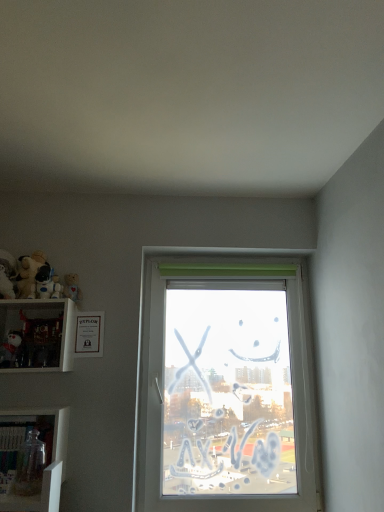
Where is `matte white plush at left, acting as the 2th toy starting from the bottom`? This screenshot has width=384, height=512. matte white plush at left, acting as the 2th toy starting from the bottom is located at coordinates tap(11, 349).

How much space does clear glass jar at lower left, acting as the 1th shelf starting from the bottom, occupy vertically?

9.90 inches.

The image size is (384, 512). Describe the element at coordinates (224, 383) in the screenshot. I see `transparent glass window at center` at that location.

Image resolution: width=384 pixels, height=512 pixels. What do you see at coordinates (28, 274) in the screenshot? I see `soft plush bear at upper left, the 2th toy in the top-to-bottom sequence` at bounding box center [28, 274].

Describe the element at coordinates (36, 335) in the screenshot. I see `white glossy shelf at left, the first shelf in the top-to-bottom sequence` at that location.

This screenshot has height=512, width=384. I want to click on matte white plush at left, acting as the 2th toy starting from the bottom, so click(x=11, y=349).

Based on the photo, how different are the orientations of white glossy shelf at left, the second shelf when ordered from bottom to top, and clear glass jar at lower left, the second shelf viewed from the top, in degrees?

5.39e-05 degrees.

Which of these two, white glossy shelf at left, the second shelf when ordered from bottom to top, or clear glass jar at lower left, acting as the 1th shelf starting from the bottom, stands taller?

With more height is white glossy shelf at left, the second shelf when ordered from bottom to top.

From a real-world perspective, is white glossy shelf at left, the second shelf when ordered from bottom to top, located beneath clear glass jar at lower left, the second shelf viewed from the top?

Incorrect, from a real-world perspective, white glossy shelf at left, the second shelf when ordered from bottom to top, is higher than clear glass jar at lower left, the second shelf viewed from the top.

From the image's perspective, which object appears higher, white glossy shelf at left, the second shelf when ordered from bottom to top, or clear glass jar at lower left, the second shelf viewed from the top?

white glossy shelf at left, the second shelf when ordered from bottom to top, is shown above in the image.

Could you measure the distance between white glossy shelf at left, the second shelf when ordered from bottom to top, and transparent glass jar at lower left, the fifth toy from the top?

white glossy shelf at left, the second shelf when ordered from bottom to top, and transparent glass jar at lower left, the fifth toy from the top, are 15.81 inches apart from each other.

From the image's perspective, which is below, white glossy shelf at left, the first shelf in the top-to-bottom sequence, or transparent glass jar at lower left, the fifth toy from the top?

transparent glass jar at lower left, the fifth toy from the top, appears lower in the image.

Is white glossy shelf at left, the first shelf in the top-to-bottom sequence, inside the boundaries of transparent glass jar at lower left, the fifth toy from the top, or outside?

white glossy shelf at left, the first shelf in the top-to-bottom sequence, lies outside transparent glass jar at lower left, the fifth toy from the top.

Is white plush toy at upper left, placed as the third toy when sorted from bottom to top, completely or partially outside of matte white plush at left, placed as the 4th toy when sorted from top to bottom?

That's correct, white plush toy at upper left, placed as the third toy when sorted from bottom to top, is outside of matte white plush at left, placed as the 4th toy when sorted from top to bottom.

Between white plush toy at upper left, which appears as the third toy when viewed from the top, and matte white plush at left, placed as the 4th toy when sorted from top to bottom, which one has smaller width?

white plush toy at upper left, which appears as the third toy when viewed from the top, is thinner.

Are soft plush bear at upper left, which is the 4th toy in bottom-to-top order, and transparent glass window at center located far from each other?

soft plush bear at upper left, which is the 4th toy in bottom-to-top order, is actually quite close to transparent glass window at center.

From a real-world perspective, does soft plush bear at upper left, which is the 4th toy in bottom-to-top order, sit lower than transparent glass window at center?

Incorrect, from a real-world perspective, soft plush bear at upper left, which is the 4th toy in bottom-to-top order, is higher than transparent glass window at center.

Is soft plush bear at upper left, the 2th toy in the top-to-bottom sequence, wider than transparent glass window at center?

Indeed, soft plush bear at upper left, the 2th toy in the top-to-bottom sequence, has a greater width compared to transparent glass window at center.

Considering the points (26, 261) and (220, 281), which point is in front, point (26, 261) or point (220, 281)?

Point (26, 261)

Is matte white plush at left, placed as the 4th toy when sorted from top to bottom, next to fluffy beige teddy bear at left, which is counted as the 5th toy, starting from the bottom?

matte white plush at left, placed as the 4th toy when sorted from top to bottom, and fluffy beige teddy bear at left, which is counted as the 5th toy, starting from the bottom, are clearly separated.

Relative to fluffy beige teddy bear at left, the 1th toy in the top-to-bottom sequence, is matte white plush at left, acting as the 2th toy starting from the bottom, in front or behind?

matte white plush at left, acting as the 2th toy starting from the bottom, is in front of fluffy beige teddy bear at left, the 1th toy in the top-to-bottom sequence.

Is matte white plush at left, acting as the 2th toy starting from the bottom, turned away from fluffy beige teddy bear at left, the 1th toy in the top-to-bottom sequence?

That's not correct — matte white plush at left, acting as the 2th toy starting from the bottom, is not looking away from fluffy beige teddy bear at left, the 1th toy in the top-to-bottom sequence.

From a real-world perspective, does matte white plush at left, placed as the 4th toy when sorted from top to bottom, stand above soft plush bear at upper left, which is the 4th toy in bottom-to-top order?

Incorrect, from a real-world perspective, matte white plush at left, placed as the 4th toy when sorted from top to bottom, is lower than soft plush bear at upper left, which is the 4th toy in bottom-to-top order.

Is matte white plush at left, placed as the 4th toy when sorted from top to bottom, looking in the opposite direction of soft plush bear at upper left, the 2th toy in the top-to-bottom sequence?

No, soft plush bear at upper left, the 2th toy in the top-to-bottom sequence, is not at the back of matte white plush at left, placed as the 4th toy when sorted from top to bottom.

From the image's perspective, is matte white plush at left, acting as the 2th toy starting from the bottom, beneath soft plush bear at upper left, which is the 4th toy in bottom-to-top order?

Indeed, from the image's perspective, matte white plush at left, acting as the 2th toy starting from the bottom, is shown beneath soft plush bear at upper left, which is the 4th toy in bottom-to-top order.

Is soft plush bear at upper left, which is the 4th toy in bottom-to-top order, completely or partially inside matte white plush at left, acting as the 2th toy starting from the bottom?

No, soft plush bear at upper left, which is the 4th toy in bottom-to-top order, is located outside of matte white plush at left, acting as the 2th toy starting from the bottom.

Choose the correct answer: Is soft plush bear at upper left, which is the 4th toy in bottom-to-top order, inside matte white plush at left, placed as the 4th toy when sorted from top to bottom, or outside it?

soft plush bear at upper left, which is the 4th toy in bottom-to-top order, is spatially situated outside matte white plush at left, placed as the 4th toy when sorted from top to bottom.

Is there a large distance between soft plush bear at upper left, the 2th toy in the top-to-bottom sequence, and matte white plush at left, acting as the 2th toy starting from the bottom?

No, soft plush bear at upper left, the 2th toy in the top-to-bottom sequence, is not far from matte white plush at left, acting as the 2th toy starting from the bottom.

Is soft plush bear at upper left, the 2th toy in the top-to-bottom sequence, further to the viewer compared to matte white plush at left, acting as the 2th toy starting from the bottom?

Yes, soft plush bear at upper left, the 2th toy in the top-to-bottom sequence, is behind matte white plush at left, acting as the 2th toy starting from the bottom.

Between soft plush bear at upper left, the 2th toy in the top-to-bottom sequence, and matte white plush at left, placed as the 4th toy when sorted from top to bottom, which one has larger size?

Bigger between the two is soft plush bear at upper left, the 2th toy in the top-to-bottom sequence.

The image size is (384, 512). In order to click on shelf on the left of the clear glass jar at lower left, acting as the 1th shelf starting from the bottom in this screenshot , I will do `click(36, 335)`.

From the image's perspective, starting from the transparent glass jar at lower left, the 1th toy from the bottom, which shelf is the 2nd one above? Please provide its 2D coordinates.

[(36, 335)]

Looking at the image, which one is located further to transparent glass window at center, white plush toy at upper left, which appears as the third toy when viewed from the top, or soft plush bear at upper left, which is the 4th toy in bottom-to-top order?

soft plush bear at upper left, which is the 4th toy in bottom-to-top order, is further to transparent glass window at center.

Looking at the image, which one is located further to transparent glass window at center, white plush toy at upper left, which appears as the third toy when viewed from the top, or white glossy shelf at left, the first shelf in the top-to-bottom sequence?

white plush toy at upper left, which appears as the third toy when viewed from the top, lies further to transparent glass window at center than the other object.

Looking at the image, which one is located further to white plush toy at upper left, which appears as the third toy when viewed from the top, white glossy shelf at left, the second shelf when ordered from bottom to top, or clear glass jar at lower left, the second shelf viewed from the top?

The object further to white plush toy at upper left, which appears as the third toy when viewed from the top, is clear glass jar at lower left, the second shelf viewed from the top.

Based on their spatial positions, is transparent glass window at center or transparent glass jar at lower left, the fifth toy from the top, closer to white plush toy at upper left, placed as the third toy when sorted from bottom to top?

transparent glass jar at lower left, the fifth toy from the top.

Looking at the image, which one is located closer to white plush toy at upper left, placed as the third toy when sorted from bottom to top, fluffy beige teddy bear at left, which is counted as the 5th toy, starting from the bottom, or soft plush bear at upper left, which is the 4th toy in bottom-to-top order?

soft plush bear at upper left, which is the 4th toy in bottom-to-top order, lies closer to white plush toy at upper left, placed as the third toy when sorted from bottom to top, than the other object.

Estimate the real-world distances between objects in this image. Which object is closer to transparent glass jar at lower left, the fifth toy from the top, matte white plush at left, acting as the 2th toy starting from the bottom, or transparent glass window at center?

matte white plush at left, acting as the 2th toy starting from the bottom.

When comparing their distances from soft plush bear at upper left, the 2th toy in the top-to-bottom sequence, does white plush toy at upper left, placed as the third toy when sorted from bottom to top, or matte white plush at left, placed as the 4th toy when sorted from top to bottom, seem further?

Based on the image, matte white plush at left, placed as the 4th toy when sorted from top to bottom, appears to be further to soft plush bear at upper left, the 2th toy in the top-to-bottom sequence.

Looking at the image, which one is located further to transparent glass jar at lower left, the fifth toy from the top, matte white plush at left, placed as the 4th toy when sorted from top to bottom, or clear glass jar at lower left, acting as the 1th shelf starting from the bottom?

matte white plush at left, placed as the 4th toy when sorted from top to bottom, is further to transparent glass jar at lower left, the fifth toy from the top.

Image resolution: width=384 pixels, height=512 pixels. I want to click on toy located between white plush toy at upper left, placed as the third toy when sorted from bottom to top, and transparent glass window at center in the left-right direction, so click(30, 466).

I want to click on toy between soft plush bear at upper left, which is the 4th toy in bottom-to-top order, and matte white plush at left, acting as the 2th toy starting from the bottom, from top to bottom, so click(47, 283).

In order to click on shelf that lies between white glossy shelf at left, the second shelf when ordered from bottom to top, and transparent glass jar at lower left, the 1th toy from the bottom, from top to bottom in this screenshot , I will do `click(32, 459)`.

Where is `toy between white glossy shelf at left, the second shelf when ordered from bottom to top, and transparent glass jar at lower left, the fifth toy from the top, from top to bottom`? This screenshot has height=512, width=384. toy between white glossy shelf at left, the second shelf when ordered from bottom to top, and transparent glass jar at lower left, the fifth toy from the top, from top to bottom is located at coordinates pos(11,349).